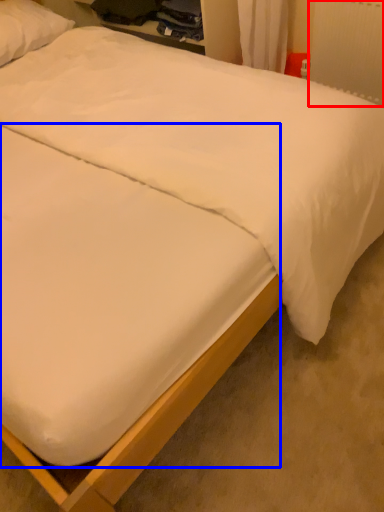
Question: Among these objects, which one is nearest to the camera, radiator (highlighted by a red box) or mattress (highlighted by a blue box)?

Choices:
 (A) radiator
 (B) mattress

Answer: (B)